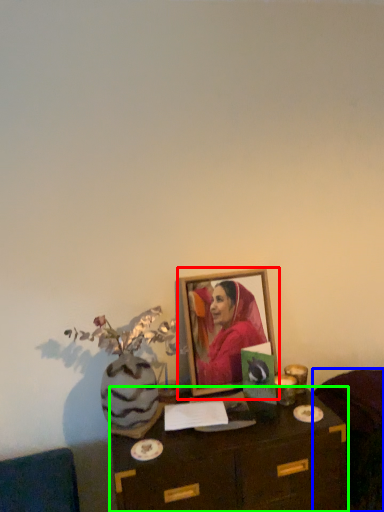
Question: Which object is the closest to the picture frame (highlighted by a red box)? Choose among these: furniture (highlighted by a blue box) or table (highlighted by a green box).

Choices:
 (A) furniture
 (B) table

Answer: (B)